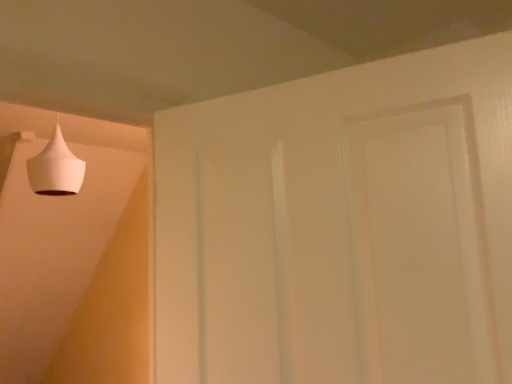
Question: Should I look upward or downward to see white matte cone at upper left?

Choices:
 (A) down
 (B) up

Answer: (B)